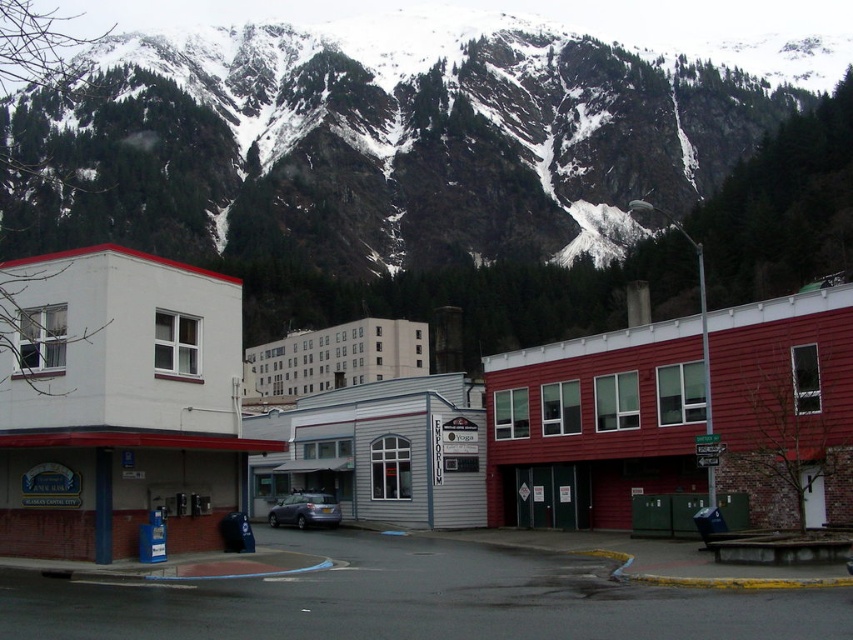
Does snowy rock at upper center have a lesser height compared to white matte building at center-left?

No.

Is point (117, 124) positioned before point (850, 307)?

No.

Which is behind, point (601, 97) or point (727, 467)?

Point (601, 97)

Identify the location of snowy rock at upper center. (437, 170).

Which of these two, snowy rock at upper center or metallic gray car at center, stands shorter?

metallic gray car at center

Where is `snowy rock at upper center`? Image resolution: width=853 pixels, height=640 pixels. snowy rock at upper center is located at coordinates (437, 170).

Image resolution: width=853 pixels, height=640 pixels. In order to click on snowy rock at upper center in this screenshot , I will do `click(437, 170)`.

Can you confirm if white matte building at center-left is positioned to the right of metallic gray car at center?

No, white matte building at center-left is not to the right of metallic gray car at center.

Between point (613, 429) and point (267, 522), which one is positioned behind?

The point (267, 522) is more distant.

Is point (13, 483) more distant than point (312, 525)?

No, it is in front of (312, 525).

I want to click on white matte building at center-left, so click(334, 420).